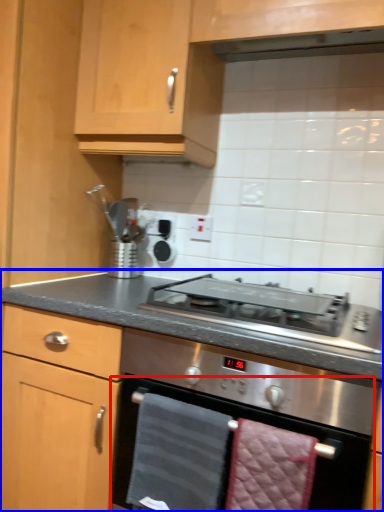
Question: Which of the following is the farthest to the observer, oven (highlighted by a red box) or countertop (highlighted by a blue box)?

Choices:
 (A) oven
 (B) countertop

Answer: (A)